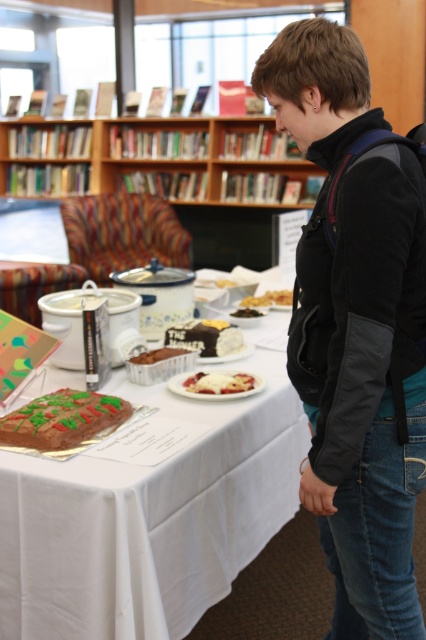
Question: Does black softshell jacket at center lie behind chocolatesmoothcake at center?

Choices:
 (A) yes
 (B) no

Answer: (B)

Question: Considering the real-world distances, which object is farthest from the dark chocolate cake at center?

Choices:
 (A) black softshell jacket at center
 (B) slightly browned cake at center
 (C) green frosted cake at lower left
 (D) chocolatesmoothcake at center

Answer: (A)

Question: Considering the relative positions of black softshell jacket at center and chocolatesmoothcake at center in the image provided, where is black softshell jacket at center located with respect to chocolatesmoothcake at center?

Choices:
 (A) below
 (B) above

Answer: (B)

Question: Can you confirm if chocolate cake at center is positioned to the left of slightly browned cake at center?

Choices:
 (A) yes
 (B) no

Answer: (A)

Question: Among these objects, which one is nearest to the camera?

Choices:
 (A) chocolatesmoothcake at center
 (B) chocolate cake at center
 (C) white creamy cake at center
 (D) black softshell jacket at center

Answer: (D)

Question: Estimate the real-world distances between objects in this image. Which object is farther from the white cloth table at center?

Choices:
 (A) chocolatesmoothcake at center
 (B) white creamy cake at center
 (C) slightly browned cake at center
 (D) dark chocolate cake at center

Answer: (C)